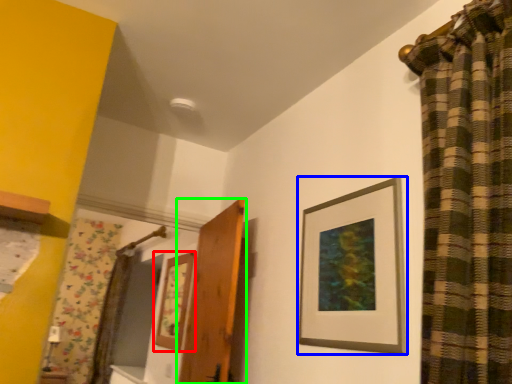
Question: Considering the real-world distances, which object is farthest from picture frame (highlighted by a red box)? picture frame (highlighted by a blue box) or door (highlighted by a green box)?

Choices:
 (A) picture frame
 (B) door

Answer: (A)